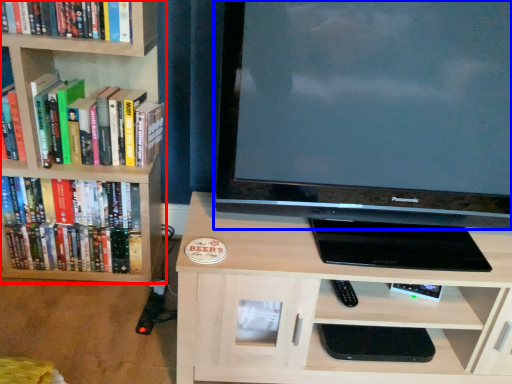
Question: Which of the following is the farthest to the observer, bookcase (highlighted by a red box) or television (highlighted by a blue box)?

Choices:
 (A) bookcase
 (B) television

Answer: (A)